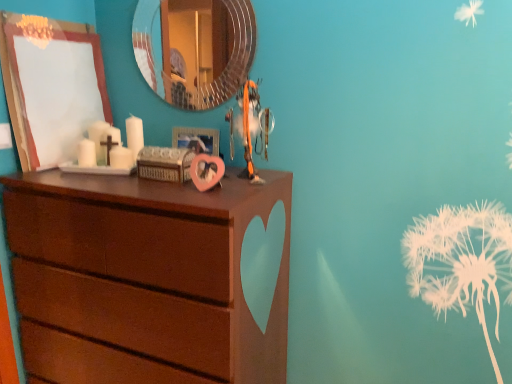
Find the location of a particular element. This screenshot has height=384, width=512. free location in front of orange fabric toy at center is located at coordinates (225, 188).